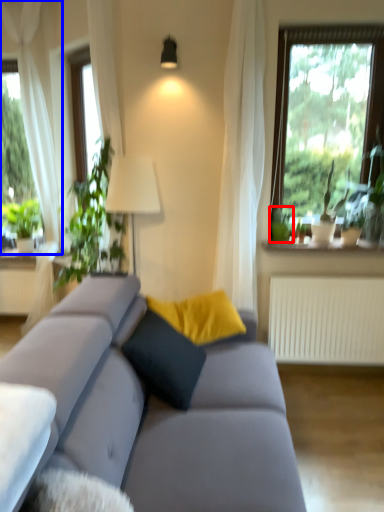
Question: Which object appears closest to the camera in this image, plant (highlighted by a red box) or curtain (highlighted by a blue box)?

Choices:
 (A) plant
 (B) curtain

Answer: (A)